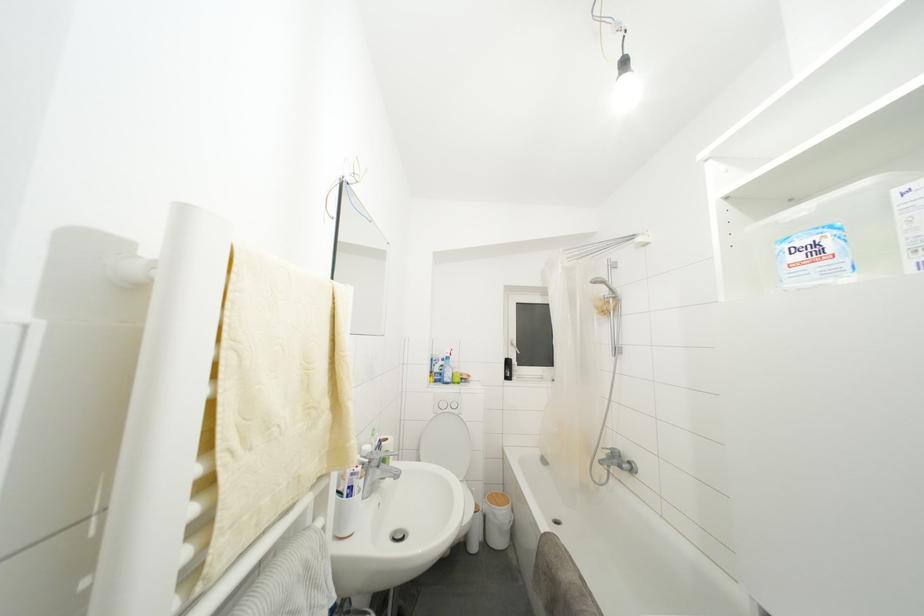
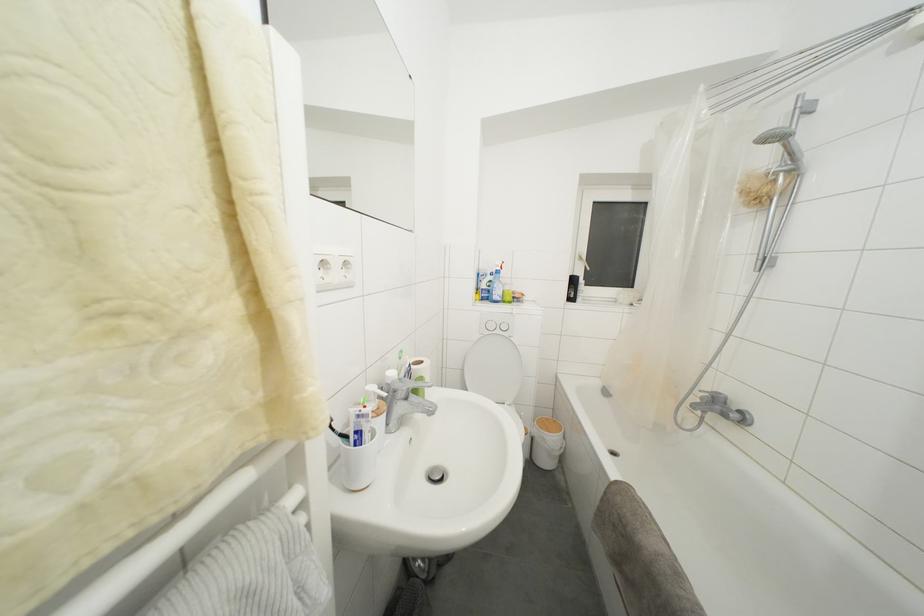
Find the pixel in the second image that matches pixel 399 536 in the first image.

(436, 475)